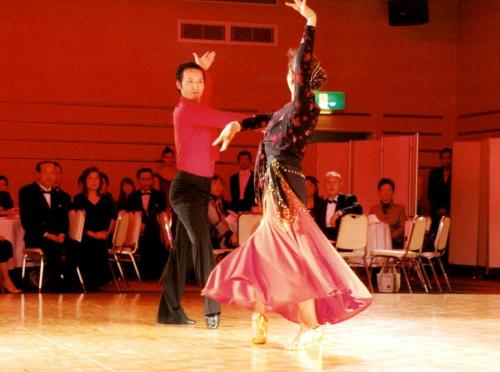
At what (x,y) coordinates should I click in order to perform the action: click on vent. Please return your answer as a coordinate pair (x, y). This screenshot has width=500, height=372. Looking at the image, I should click on (217, 35), (242, 35).